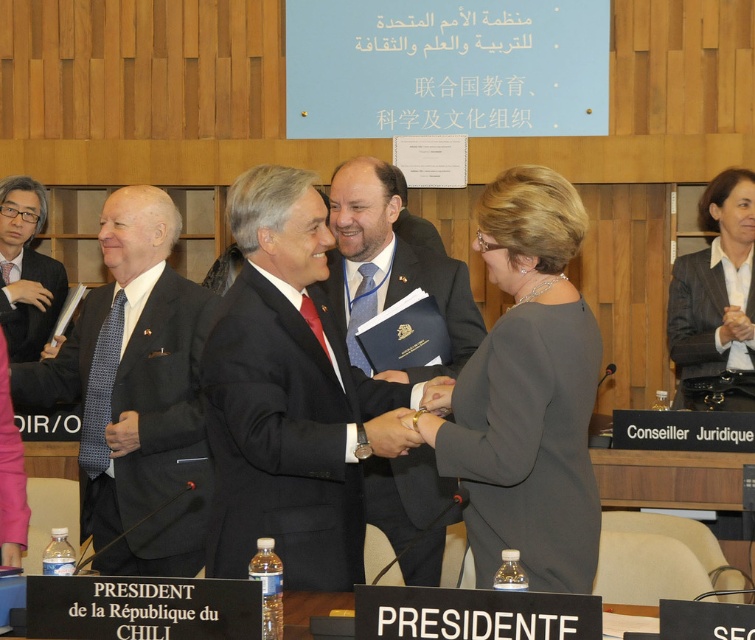
You are standing in the conference room and see two points marked on the floor. The first point is at coordinates point (479, 333) and the second point is at point (14, 360). Which point is closer to you?

Point (479, 333) is closer to the viewer than point (14, 360).

You are a photographer at the event and need to ensure that both the black satin suit at center and the black satin business suit at right are visible in the photo. Given that your camera has a fixed focus that can only clearly capture objects up to 1.5 meters tall, will both suits be in focus?

The black satin suit at center is taller than the black satin business suit at right. Since the camera can only focus on objects up to 1.5 meters tall, if the taller suit exceeds this height, it might be out of focus. However, the description does not specify their exact heights, so we cannot definitively answer without more information.